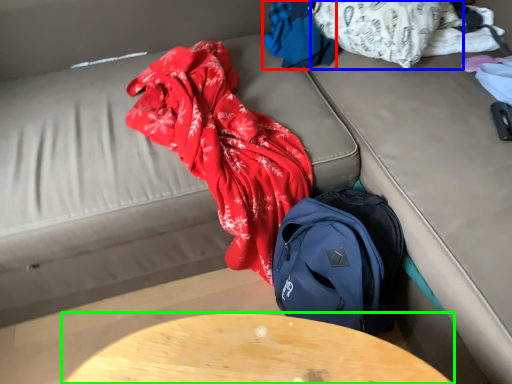
Question: Which object is positioned farthest from clothing (highlighted by a red box)? Select from clothing (highlighted by a blue box) and table (highlighted by a green box).

Choices:
 (A) clothing
 (B) table

Answer: (B)